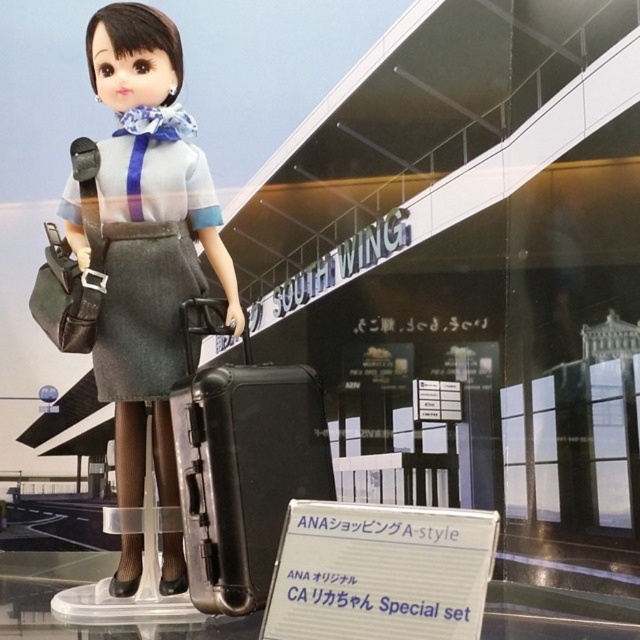
Is matte black suitcase at lower center thinner than black hard suitcase at center?

No.

Between point (141, 77) and point (193, 385), which one is positioned behind?

Point (141, 77)

This screenshot has width=640, height=640. I want to click on matte black suitcase at lower center, so click(150, 224).

Who is positioned more to the left, matte black suitcase at lower center or denim skirt at center?

From the viewer's perspective, denim skirt at center appears more on the left side.

Where is `matte black suitcase at lower center`? matte black suitcase at lower center is located at coordinates (150, 224).

Is point (205, 316) closer to camera compared to point (189, 193)?

That is True.

Who is positioned more to the right, black hard suitcase at center or denim skirt at center?

Positioned to the right is black hard suitcase at center.

Where is `black hard suitcase at center`? The width and height of the screenshot is (640, 640). black hard suitcase at center is located at coordinates (241, 464).